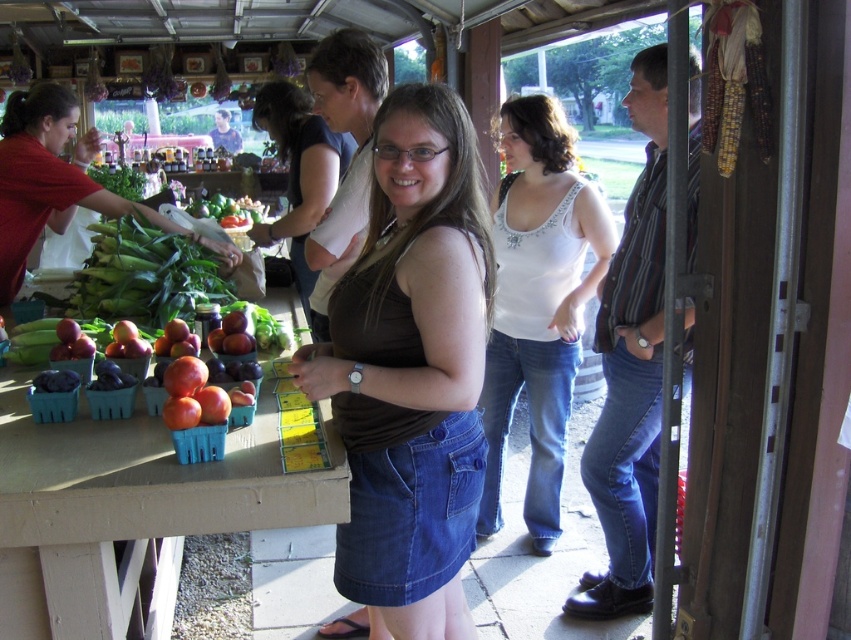
In the scene shown: Is brown denim skirt at center below green leafy corn at left?

Indeed, brown denim skirt at center is positioned under green leafy corn at left.

Does point (469, 220) come behind point (86, 291)?

No, (469, 220) is in front of (86, 291).

Find the location of a particular element. Image resolution: width=851 pixels, height=640 pixels. brown denim skirt at center is located at coordinates (410, 369).

Identify the location of brown fabric tank top at center. (300, 172).

Image resolution: width=851 pixels, height=640 pixels. What do you see at coordinates (300, 172) in the screenshot? I see `brown fabric tank top at center` at bounding box center [300, 172].

Image resolution: width=851 pixels, height=640 pixels. What are the coordinates of `brown fabric tank top at center` in the screenshot? It's located at (300, 172).

Does brown denim skirt at center appear under white jersey at center?

Yes.

Does brown denim skirt at center appear on the left side of white jersey at center?

Yes, brown denim skirt at center is to the left of white jersey at center.

You are a GUI agent. You are given a task and a screenshot of the screen. Output one action in this format:
    pyautogui.click(x=<x>, y=<y>)
    Task: Click on the brown denim skirt at center
    
    Given the screenshot: What is the action you would take?
    pyautogui.click(x=410, y=369)